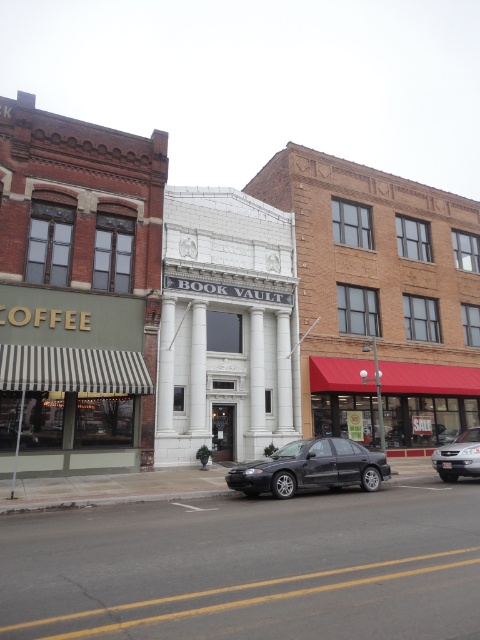
You are a delivery person with a 3.5 meter long truck. You need to park your truck between the matte white building at center and the satin silver sedan at lower right. Is there enough space for your truck to fit between them?

The distance between the matte white building at center and the satin silver sedan at lower right is 11.74 meters. Since your truck is only 3.5 meters long, there is sufficient space to park it between them as 11.74 meters is greater than 3.5 meters.